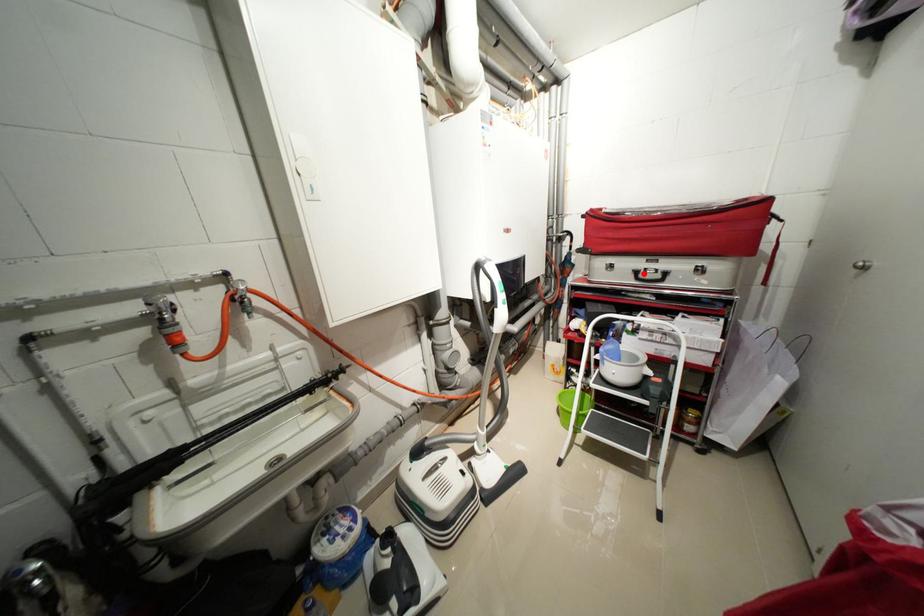
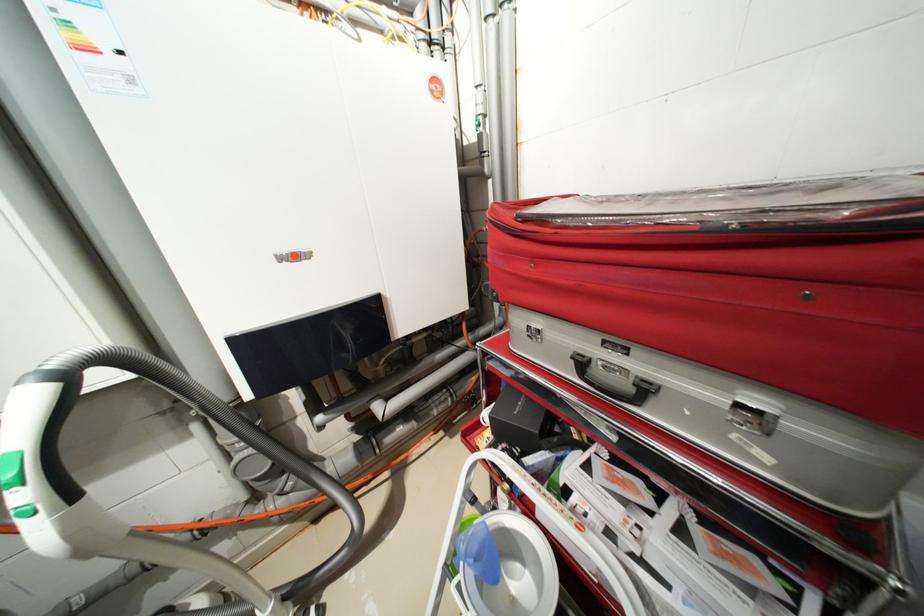
Where in the second image is the point corresponding to the highlighted location from the first image?

(589, 363)